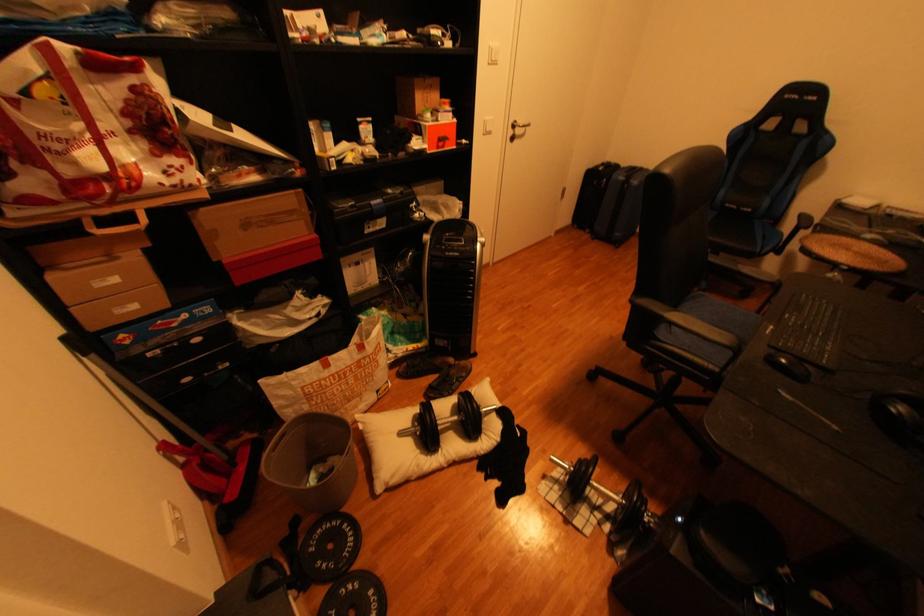
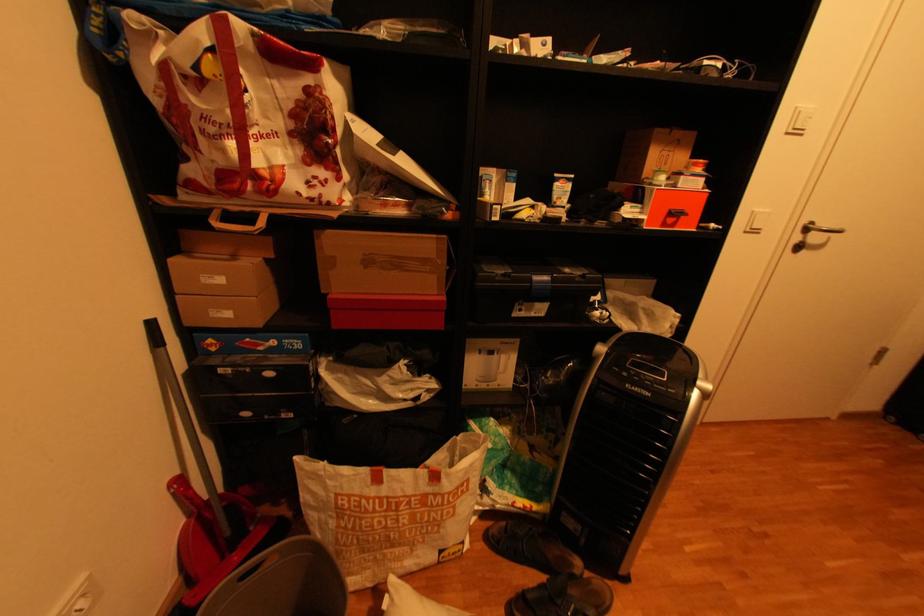
Locate, in the second image, the point that corresponds to [454,103] in the first image.

(704, 166)